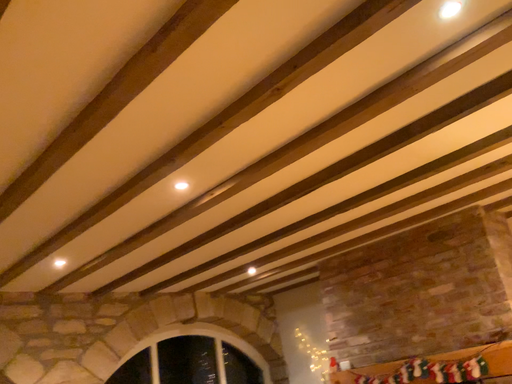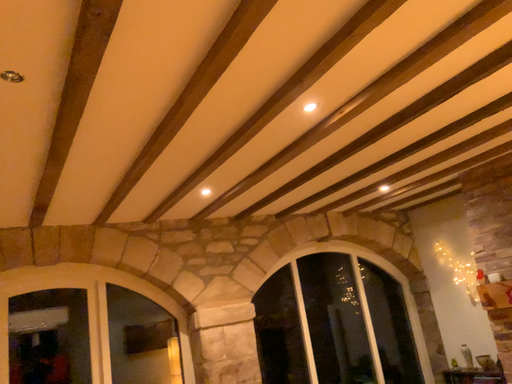
Question: How did the camera likely rotate when shooting the video?

Choices:
 (A) rotated downward
 (B) rotated upward

Answer: (A)